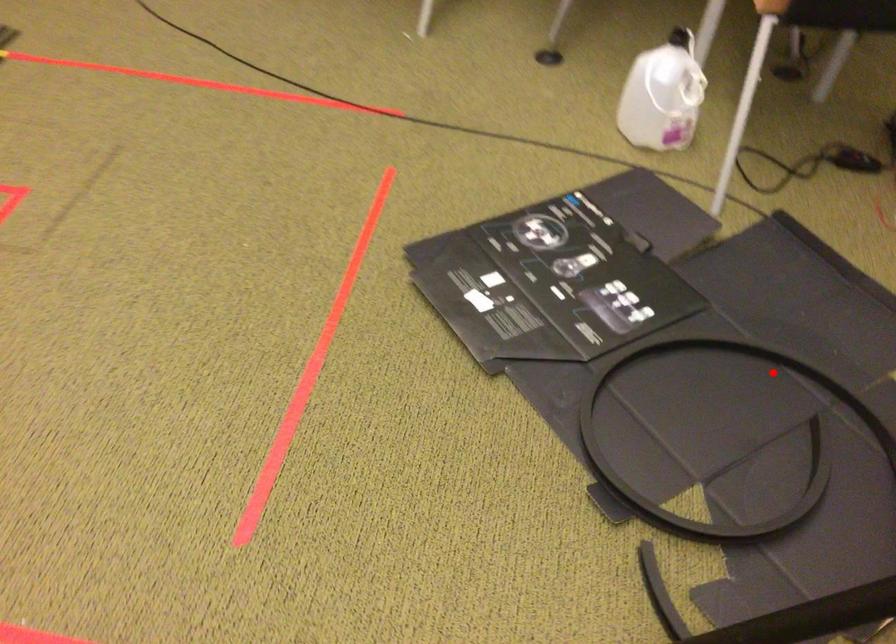
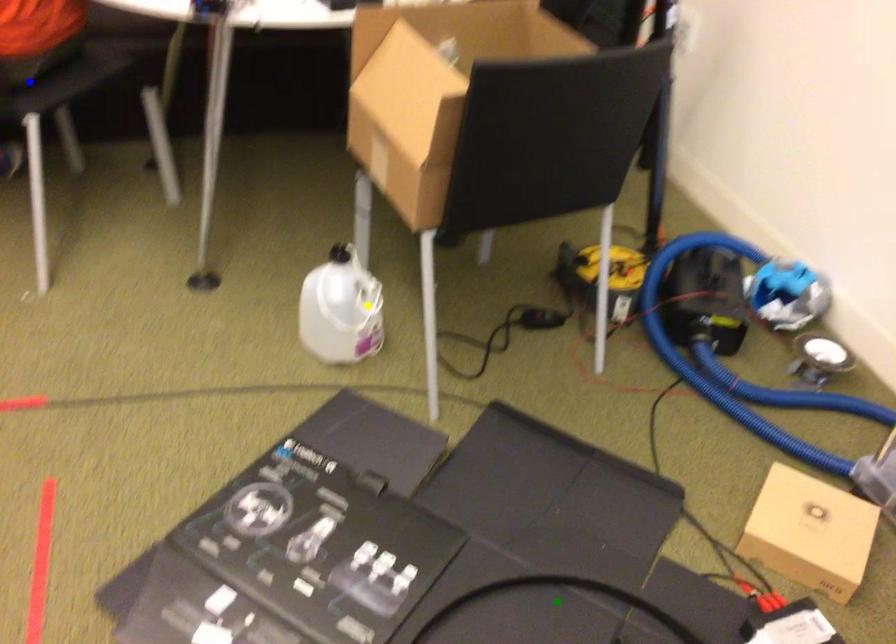
Question: I am providing you with two images of the same scene from different viewpoints. A red point is marked on the first image. You are given multiple points on the second image. Which mark in image 2 goes with the point in image 1?

Choices:
 (A) blue point
 (B) yellow point
 (C) green point

Answer: (C)